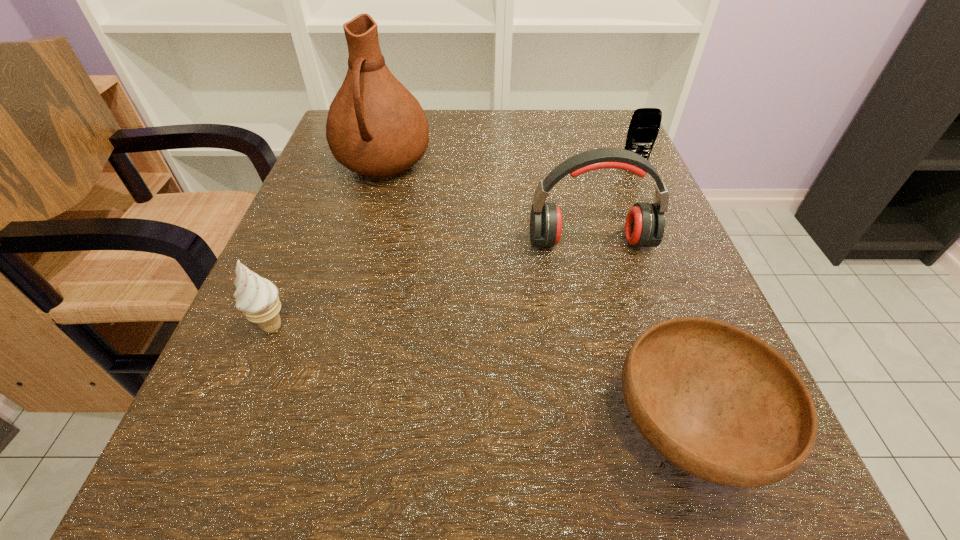
Identify the location of vacant space positioned 0.400m on the screen of the cellular telephone. (708, 342).

At what (x,y) coordinates should I click in order to perform the action: click on blank space located on the back of the shortest object. Please return your answer as a coordinate pair (x, y). Image resolution: width=960 pixels, height=540 pixels. Looking at the image, I should click on (612, 207).

The width and height of the screenshot is (960, 540). In order to click on pitcher at the far edge in this screenshot , I will do `click(375, 127)`.

Find the location of `cellular telephone that is at the far edge`. cellular telephone that is at the far edge is located at coordinates (644, 126).

At what (x,y) coordinates should I click in order to perform the action: click on object at the near edge. Please return your answer as a coordinate pair (x, y). The image size is (960, 540). Looking at the image, I should click on (716, 401).

Identify the location of pitcher that is at the left edge. (375, 127).

In order to click on icecream present at the left edge in this screenshot , I will do `click(257, 297)`.

Find the location of a particular element. The width and height of the screenshot is (960, 540). earphone situated at the right edge is located at coordinates (645, 223).

Locate an element on the screen. The width and height of the screenshot is (960, 540). cellular telephone located in the right edge section of the desktop is located at coordinates (644, 126).

This screenshot has height=540, width=960. I want to click on bowl located at the right edge, so (716, 401).